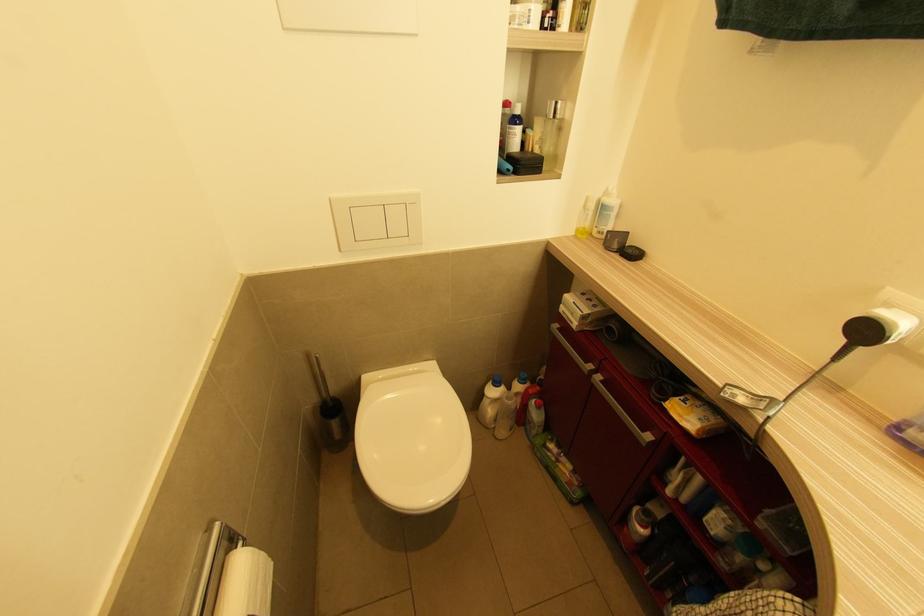
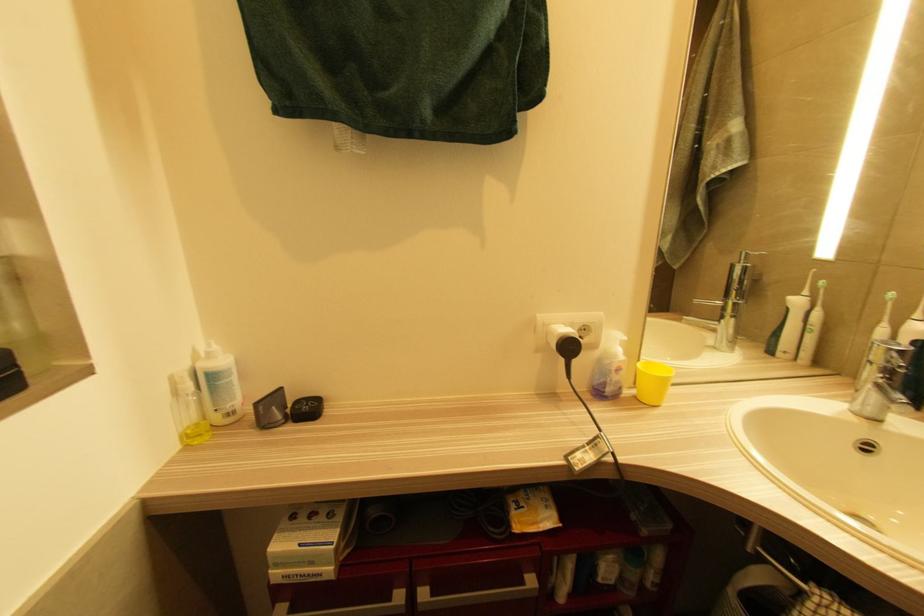
Question: The camera is either moving clockwise (left) or counter-clockwise (right) around the object. The first image is from the beginning of the video and the second image is from the end. Is the camera moving left or right when shooting the video?

Choices:
 (A) Left
 (B) Right

Answer: (A)